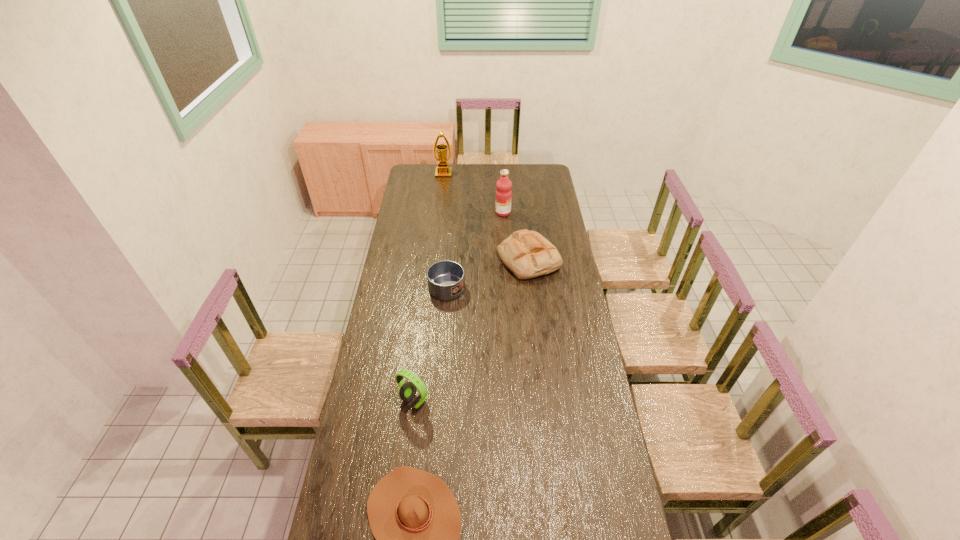
In the image, there is a desktop. Where is `vacant space at the right edge`? Image resolution: width=960 pixels, height=540 pixels. vacant space at the right edge is located at coordinates (572, 434).

In the image, there is a desktop. Identify the location of vacant space at the far left corner. (423, 166).

This screenshot has width=960, height=540. I want to click on free spot between the fifth nearest object and the fifth tallest object, so click(475, 242).

You are a GUI agent. You are given a task and a screenshot of the screen. Output one action in this format:
    pyautogui.click(x=<x>, y=<y>)
    Task: Click on the vacant area between the second farthest object and the fifth farthest object
    
    Given the screenshot: What is the action you would take?
    pyautogui.click(x=459, y=306)

Identify the location of object that stands as the third closest to the second shortest object. (407, 391).

Find the location of a particular element. This screenshot has width=960, height=540. object that is the third closest one to the award is located at coordinates (527, 254).

Find the location of a particular element. This screenshot has height=540, width=960. vacant space that satisfies the following two spatial constraints: 1. on the label of the fourth tallest object; 2. on the left side of the fifth nearest object is located at coordinates (506, 260).